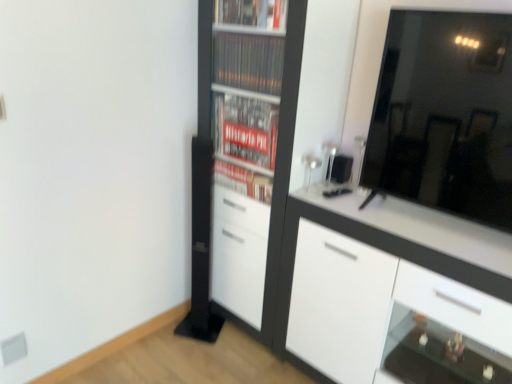
Measure the distance between black glossy mirror at upper right and camera.

1.38 meters.

Find the location of a particular element. The width and height of the screenshot is (512, 384). transparent glass shelf at lower right is located at coordinates (437, 354).

Describe the element at coordinates (392, 292) in the screenshot. I see `white glossy cabinet at right` at that location.

Identify the location of white glossy cabinet at right. This screenshot has height=384, width=512. (392, 292).

Identify the location of white matte cupboard at center. This screenshot has width=512, height=384. (260, 138).

Which object is wider, white matte cupboard at center or transparent glass shelf at lower right?

With larger width is white matte cupboard at center.

Is white matte cupboard at center far away from transparent glass shelf at lower right?

They are positioned close to each other.

Is point (326, 128) closer or farther from the camera than point (487, 355)?

Clearly, point (326, 128) is more distant from the camera than point (487, 355).

From the image's perspective, relative to transparent glass shelf at lower right, is white matte cupboard at center above or below?

Based on their image positions, white matte cupboard at center is located above transparent glass shelf at lower right.

Is black glossy mirror at upper right not close to white glossy cabinet at right?

No, black glossy mirror at upper right is not far from white glossy cabinet at right.

Considering the relative sizes of black glossy mirror at upper right and white glossy cabinet at right in the image provided, is black glossy mirror at upper right thinner than white glossy cabinet at right?

Indeed, black glossy mirror at upper right has a lesser width compared to white glossy cabinet at right.

Would you say black glossy mirror at upper right is outside white glossy cabinet at right?

That's correct, black glossy mirror at upper right is outside of white glossy cabinet at right.

How far apart are white matte cupboard at center and black glossy mirror at upper right?

A distance of 21.61 inches exists between white matte cupboard at center and black glossy mirror at upper right.

From a real-world perspective, is white matte cupboard at center on black glossy mirror at upper right?

No.

Could you tell me if white matte cupboard at center is facing black glossy mirror at upper right?

No, white matte cupboard at center is not aimed at black glossy mirror at upper right.

Considering the points (263, 32) and (406, 168), which point is in front, point (263, 32) or point (406, 168)?

The point (406, 168) is in front.

Which object is further away from the camera taking this photo, black glossy mirror at upper right or white matte cupboard at center?

white matte cupboard at center is further away from the camera.

Does black glossy mirror at upper right turn towards white matte cupboard at center?

No, black glossy mirror at upper right is not oriented towards white matte cupboard at center.

From the image's perspective, is black glossy mirror at upper right beneath white matte cupboard at center?

Actually, black glossy mirror at upper right appears above white matte cupboard at center in the image.

From the image's perspective, is white glossy cabinet at right over transparent glass shelf at lower right?

Correct, white glossy cabinet at right appears higher than transparent glass shelf at lower right in the image.

Which is behind, point (487, 253) or point (431, 370)?

The point (431, 370) is more distant.

Which of these two, white glossy cabinet at right or transparent glass shelf at lower right, is smaller?

With smaller size is transparent glass shelf at lower right.

Where is `mirror that is on the left side of transparent glass shelf at lower right`? This screenshot has height=384, width=512. mirror that is on the left side of transparent glass shelf at lower right is located at coordinates (445, 114).

From the image's perspective, is transparent glass shelf at lower right on black glossy mirror at upper right?

Incorrect, from the image's perspective, transparent glass shelf at lower right is lower than black glossy mirror at upper right.

How many degrees apart are the facing directions of transparent glass shelf at lower right and black glossy mirror at upper right?

The angular difference between transparent glass shelf at lower right and black glossy mirror at upper right is 0.0468 degrees.

Based on their sizes in the image, would you say transparent glass shelf at lower right is bigger or smaller than black glossy mirror at upper right?

In the image, transparent glass shelf at lower right appears to be smaller than black glossy mirror at upper right.

Visually, is transparent glass shelf at lower right positioned to the left or to the right of white matte cupboard at center?

In the image, transparent glass shelf at lower right appears on the right side of white matte cupboard at center.

Which is less distant, (509, 382) or (307, 90)?

Point (509, 382)

Consider the image. Considering the positions of objects transparent glass shelf at lower right and white matte cupboard at center in the image provided, who is behind, transparent glass shelf at lower right or white matte cupboard at center?

white matte cupboard at center is further from the camera.

Where is `cupboard above the transparent glass shelf at lower right (from the image's perspective)`? cupboard above the transparent glass shelf at lower right (from the image's perspective) is located at coordinates (260, 138).

I want to click on mirror located on the right of white glossy cabinet at right, so click(x=445, y=114).

Based on their spatial positions, is white matte cupboard at center or white glossy cabinet at right further from transparent glass shelf at lower right?

white matte cupboard at center lies further to transparent glass shelf at lower right than the other object.

From the image, which object appears to be farther from transparent glass shelf at lower right, black glossy mirror at upper right or white glossy cabinet at right?

black glossy mirror at upper right is further to transparent glass shelf at lower right.

When comparing their distances from white glossy cabinet at right, does white matte cupboard at center or black glossy mirror at upper right seem closer?

Based on the image, black glossy mirror at upper right appears to be nearer to white glossy cabinet at right.

From the picture: Estimate the real-world distances between objects in this image. Which object is closer to white matte cupboard at center, transparent glass shelf at lower right or white glossy cabinet at right?

The object closer to white matte cupboard at center is white glossy cabinet at right.

Based on the photo, when comparing their distances from white glossy cabinet at right, does black glossy mirror at upper right or transparent glass shelf at lower right seem further?

black glossy mirror at upper right.

Based on their spatial positions, is transparent glass shelf at lower right or white matte cupboard at center closer to black glossy mirror at upper right?

The object closer to black glossy mirror at upper right is white matte cupboard at center.

Based on their spatial positions, is white matte cupboard at center or transparent glass shelf at lower right closer to white glossy cabinet at right?

transparent glass shelf at lower right is closer to white glossy cabinet at right.

Looking at the image, which one is located further to white matte cupboard at center, black glossy mirror at upper right or transparent glass shelf at lower right?

transparent glass shelf at lower right is further to white matte cupboard at center.

The image size is (512, 384). I want to click on cabinetry between black glossy mirror at upper right and transparent glass shelf at lower right in the vertical direction, so click(392, 292).

You are a GUI agent. You are given a task and a screenshot of the screen. Output one action in this format:
    pyautogui.click(x=<x>, y=<y>)
    Task: Click on the cabinetry between white matte cupboard at center and transparent glass shelf at lower right
    The width and height of the screenshot is (512, 384).
    Given the screenshot: What is the action you would take?
    pyautogui.click(x=392, y=292)

The image size is (512, 384). I want to click on cupboard between black glossy mirror at upper right and transparent glass shelf at lower right in the vertical direction, so click(260, 138).

Identify the location of cupboard between black glossy mirror at upper right and white glossy cabinet at right from top to bottom. (260, 138).